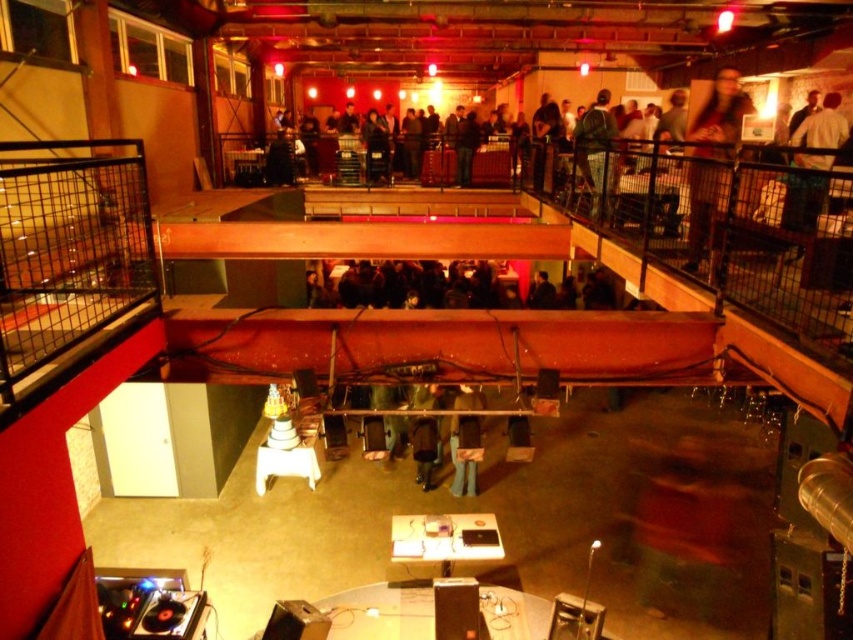
You are a security guard in the venue and need to locate two jackets left unattended. The jackets are the light brown leather jacket at upper right and the dark gray jacket at upper right. Which jacket is positioned higher in the venue?

The light brown leather jacket at upper right is positioned higher in the venue than the dark gray jacket at upper right because it is located above it.

You are standing at the DJ setup and want to walk to the point marked as point (802, 211). There is an obstacle at point (717, 115). Will you encounter this obstacle before reaching your destination?

Point (717, 115) is further to the camera than point (802, 211), so you will encounter the obstacle at point (717, 115) before reaching your destination.